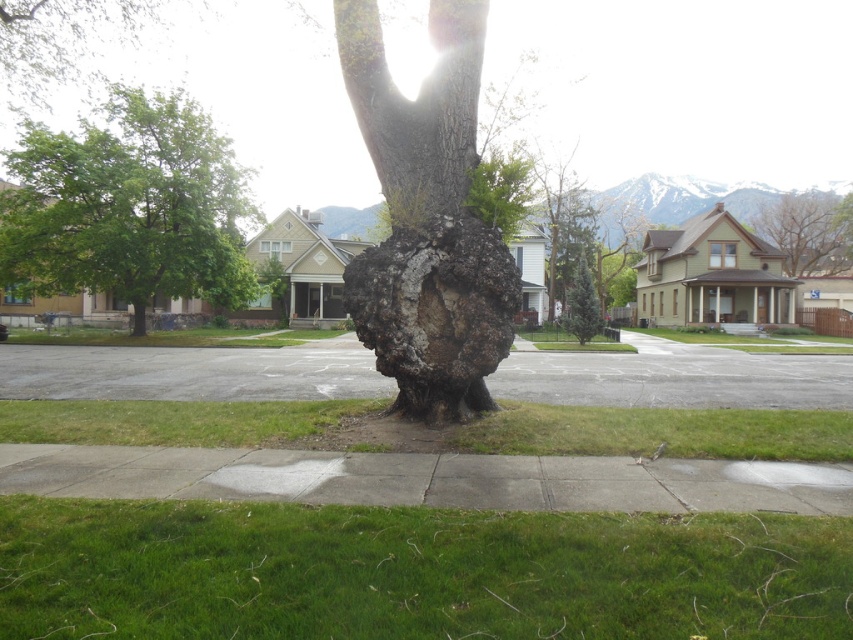
You are a gardener planning to mow the lawn. You see the green grass at lower center and the smooth bark tree trunk at center. Which area should you avoid mowing to prevent damaging the tree?

You should avoid mowing near the smooth bark tree trunk at center because the green grass at lower center is located below it, and mowing too close to the tree trunk could harm the tree roots or the bark.

You are standing at the origin point of the image coordinate system. You want to walk to the green grass at lower center. What are the coordinates you need to move to?

The coordinates you need to move to are point [413,573].

You are standing at the point closer to the camera in the image. Which point are you at, point (260, 524) or point (459, 67)?

You are at point (260, 524) because it is closer to the camera than point (459, 67).